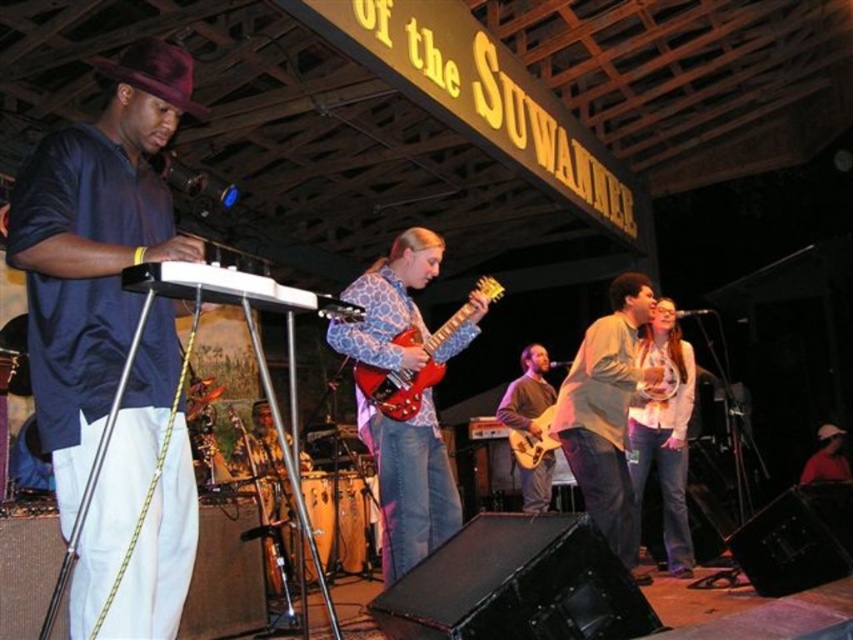
Who is positioned more to the right, light brown textured shirt at center or white matte baseball cap at lower right?

Positioned to the right is white matte baseball cap at lower right.

Is light brown textured shirt at center thinner than white matte baseball cap at lower right?

In fact, light brown textured shirt at center might be wider than white matte baseball cap at lower right.

Between point (590, 332) and point (824, 468), which one is positioned in front?

Point (590, 332)

This screenshot has width=853, height=640. What are the coordinates of `light brown textured shirt at center` in the screenshot? It's located at (607, 413).

Who is shorter, matte blue shirt at left or light brown textured shirt at center?

matte blue shirt at left

Between matte blue shirt at left and light brown textured shirt at center, which one is positioned lower?

Positioned lower is light brown textured shirt at center.

Which is behind, point (115, 141) or point (650, 577)?

The point (650, 577) is more distant.

You are a GUI agent. You are given a task and a screenshot of the screen. Output one action in this format:
    pyautogui.click(x=<x>, y=<y>)
    Task: Click on the matte blue shirt at left
    
    Given the screenshot: What is the action you would take?
    pyautogui.click(x=94, y=252)

Describe the element at coordinates (527, 392) in the screenshot. The height and width of the screenshot is (640, 853). I see `brown sweater at center` at that location.

In the scene shown: Which is above, brown sweater at center or light brown wood electric guitar at center?

light brown wood electric guitar at center is higher up.

Image resolution: width=853 pixels, height=640 pixels. What are the coordinates of `brown sweater at center` in the screenshot? It's located at (527, 392).